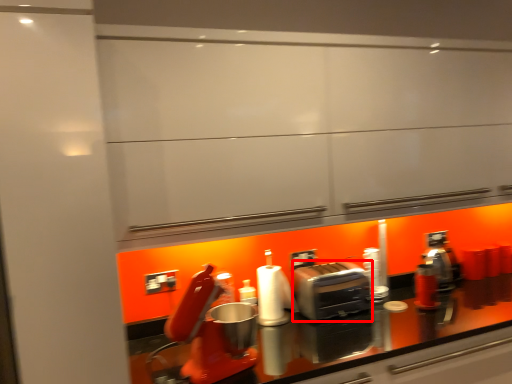
Question: From the image's perspective, what is the correct spatial relationship of toaster (annotated by the red box) in relation to paper towel?

Choices:
 (A) above
 (B) below

Answer: (B)